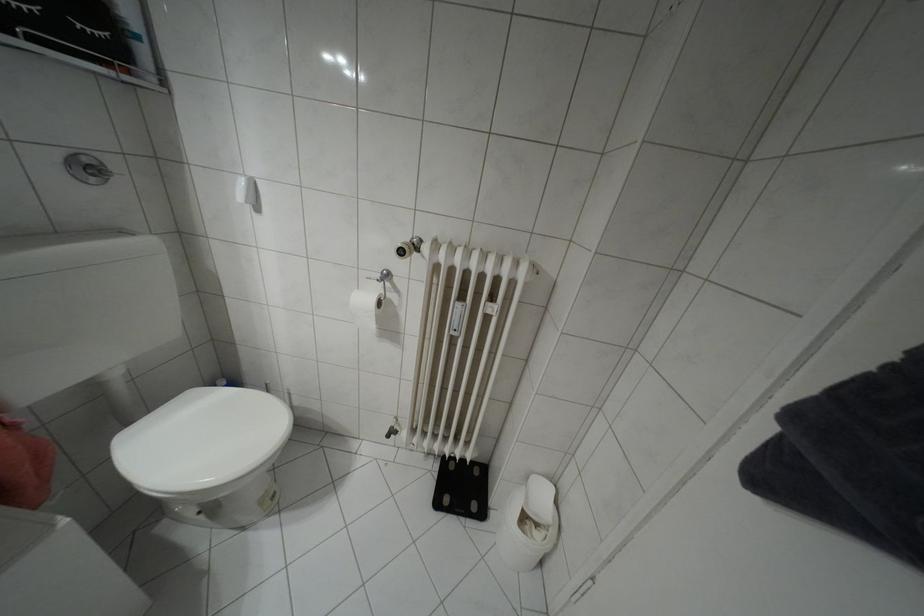
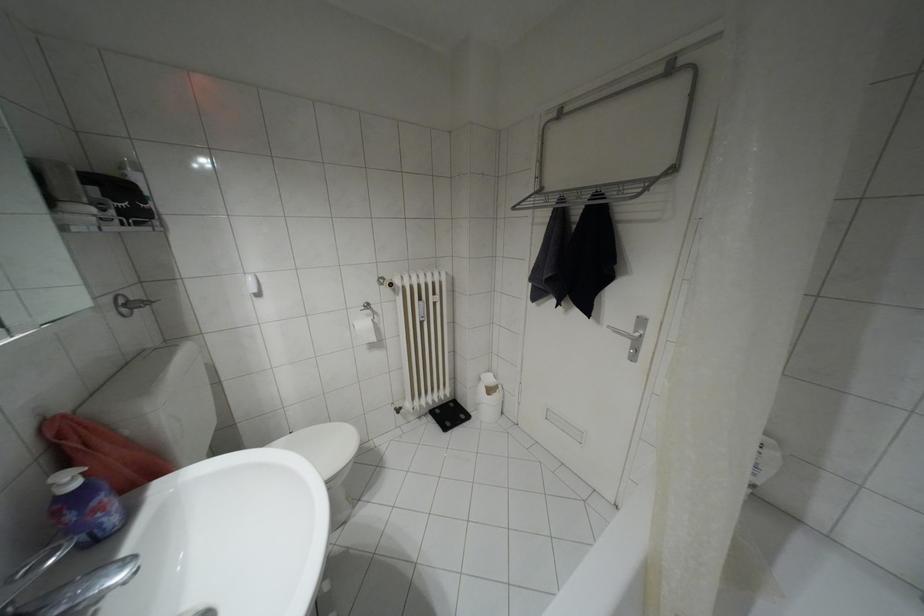
Question: How did the camera likely rotate?

Choices:
 (A) Left
 (B) Right
 (C) Up
 (D) Down

Answer: (B)